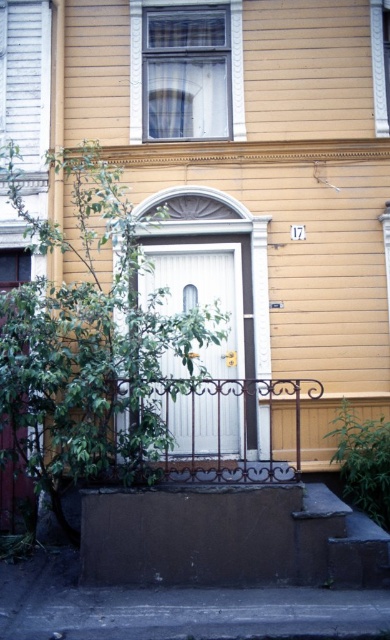
At what (x,y) coordinates should I click in order to perform the action: click on brown concrete stair at lower center. Please return your answer as a coordinate pair (x, y). Looking at the image, I should click on (207, 568).

Between point (95, 586) and point (237, 326), which one is positioned in front?

Point (95, 586) is in front.

Find the location of `brown concrete stair at lower center`. brown concrete stair at lower center is located at coordinates (207, 568).